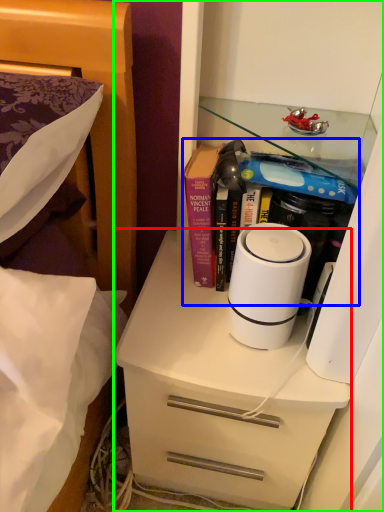
Question: Which is nearer to the chest of drawers (highlighted by a red box)? book (highlighted by a blue box) or cabinetry (highlighted by a green box).

Choices:
 (A) book
 (B) cabinetry

Answer: (A)